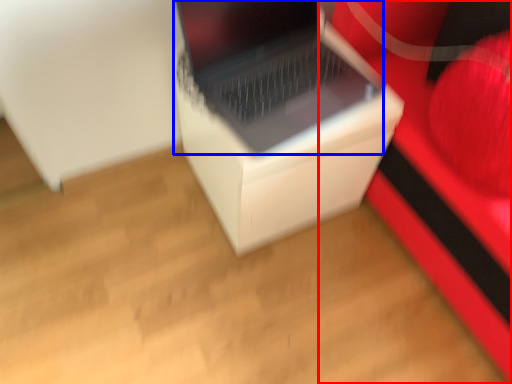
Question: Among these objects, which one is farthest to the camera, furniture (highlighted by a red box) or laptop (highlighted by a blue box)?

Choices:
 (A) furniture
 (B) laptop

Answer: (B)